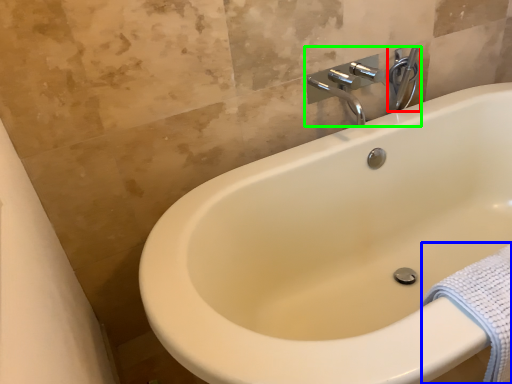
Question: Estimate the real-world distances between objects in this image. Which object is closer to plumbing fixture (highlighted by a red box), bath towel (highlighted by a blue box) or tap (highlighted by a green box)?

Choices:
 (A) bath towel
 (B) tap

Answer: (B)